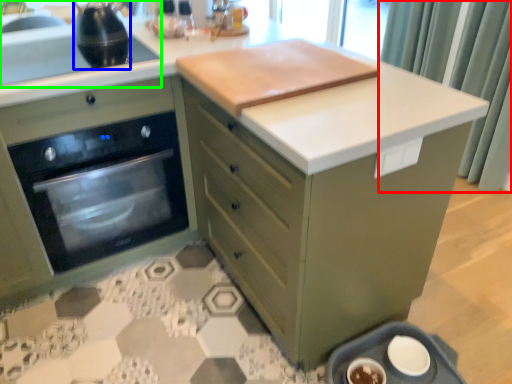
Question: Which object is the farthest from curtain (highlighted by a red box)? Choose among these: kitchen appliance (highlighted by a blue box) or sink (highlighted by a green box).

Choices:
 (A) kitchen appliance
 (B) sink

Answer: (B)